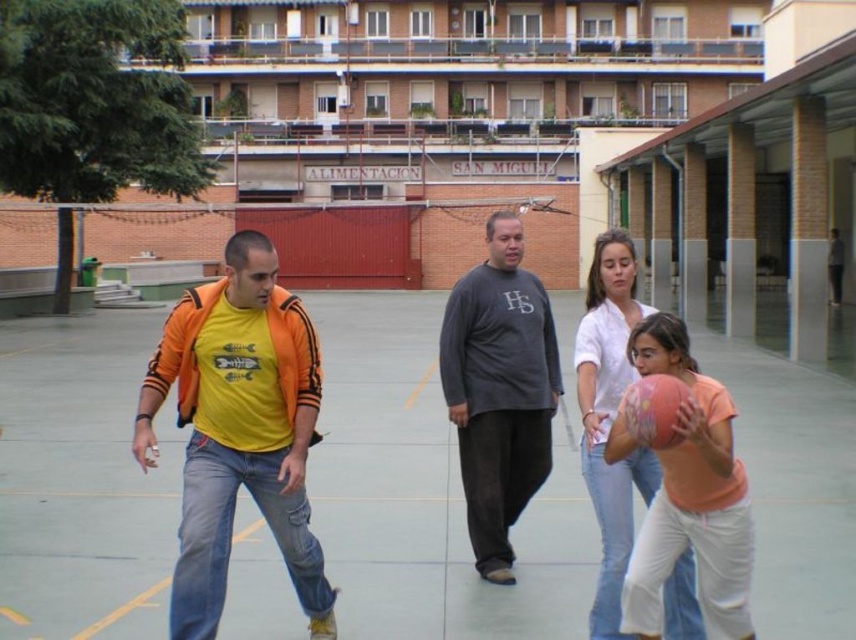
Question: Estimate the real-world distances between objects in this image. Which object is farther from the rubber basketball at center?

Choices:
 (A) matte yellow t-shirt at center
 (B) white cotton shirt at center

Answer: (A)

Question: Which of the following is the closest to the observer?

Choices:
 (A) (134, 492)
 (B) (295, 388)
 (C) (679, 404)

Answer: (C)

Question: Is gray cotton shirt at center wider than matte pink basketball at center right?

Choices:
 (A) yes
 (B) no

Answer: (A)

Question: Where is rubber basketball at center located in relation to white cotton shirt at center in the image?

Choices:
 (A) above
 (B) below

Answer: (B)

Question: Is matte yellow t-shirt at center bigger than multicolored rubber basketball at center?

Choices:
 (A) yes
 (B) no

Answer: (B)

Question: Based on their relative distances, which object is farther from the white cotton shirt at center?

Choices:
 (A) gray cotton shirt at center
 (B) matte pink basketball at center right
 (C) rubber basketball at center
 (D) multicolored rubber basketball at center

Answer: (C)